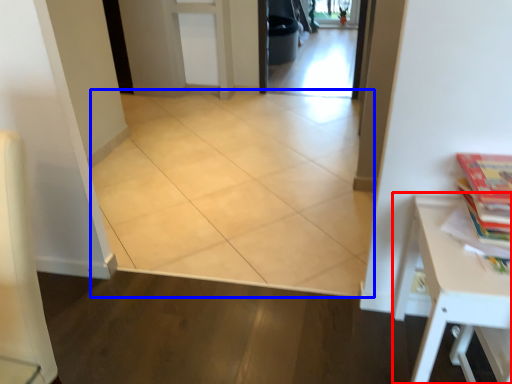
Question: Which of the following is the farthest to the observer, table (highlighted by a red box) or ceramic tile (highlighted by a blue box)?

Choices:
 (A) table
 (B) ceramic tile

Answer: (B)